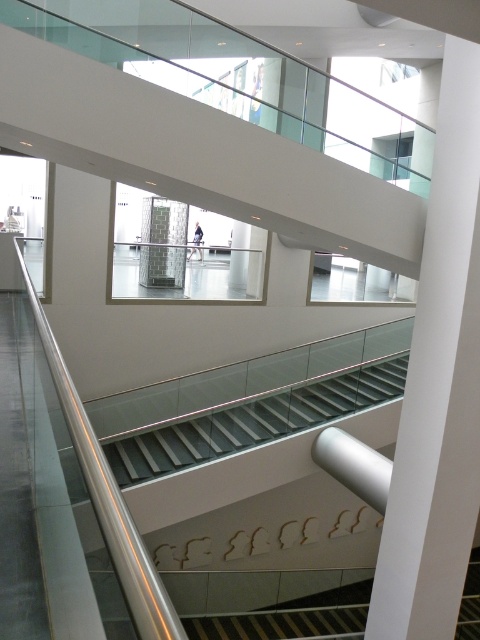
You are standing on the upper level of a modern building and want to take a photo of the white smooth pillar at center. If your camera has a maximum focus range of 14 feet, will it be able to capture the pillar clearly?

The white smooth pillar at center is 14.25 feet from the camera, which is slightly beyond the maximum focus range of 14 feet. Therefore, the camera may not be able to capture the pillar clearly.

You are a maintenance worker needing to move a 4.2 meter long ladder from the upper level to the lower level. You have to pass between the white smooth pillar at center and the white glossy stair at center. Is there enough space for the ladder to pass through?

The distance between the white smooth pillar at center and the white glossy stair at center is 3.85 meters. Since the ladder is 4.2 meters long, it is longer than the available space, so the ladder cannot pass through the gap between them.

You are standing on the upper level of a modern building and want to walk down the white glossy stair at center. However, there is a white smooth pillar at center in your path. Can you walk around the pillar to reach the stair?

The white smooth pillar at center is positioned over white glossy stair at center, meaning the pillar is directly above the stair. This creates an obstruction, so you cannot walk around the pillar to reach the stair as the stair is blocked by the pillar above.